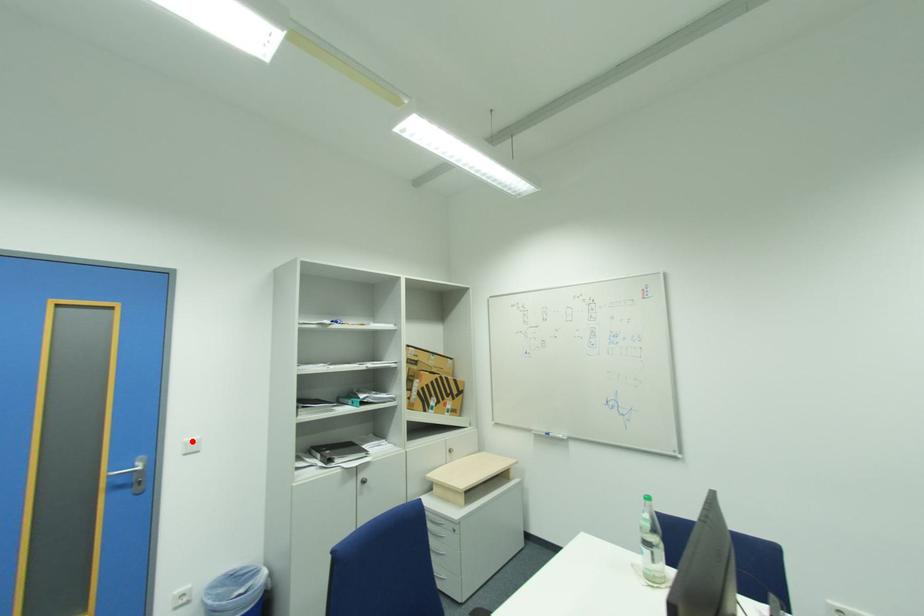
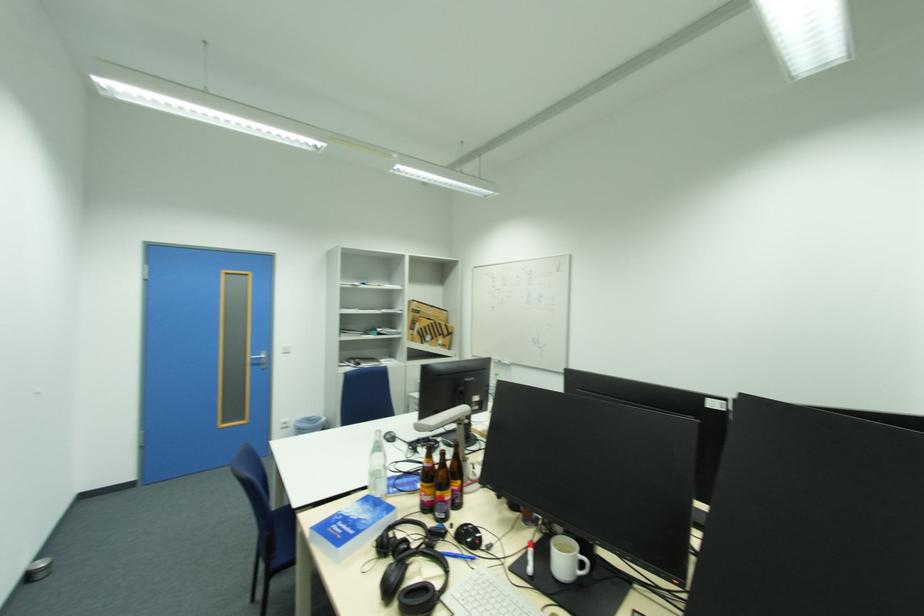
The point at the highlighted location is marked in the first image. Where is the corresponding point in the second image?

(289, 347)